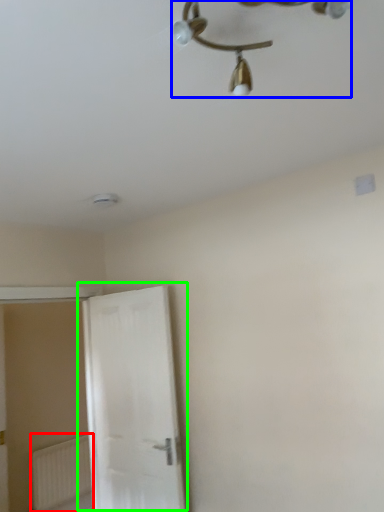
Question: Which object is positioned farthest from radiator (highlighted by a red box)? Select from lamp (highlighted by a blue box) and door (highlighted by a green box).

Choices:
 (A) lamp
 (B) door

Answer: (A)